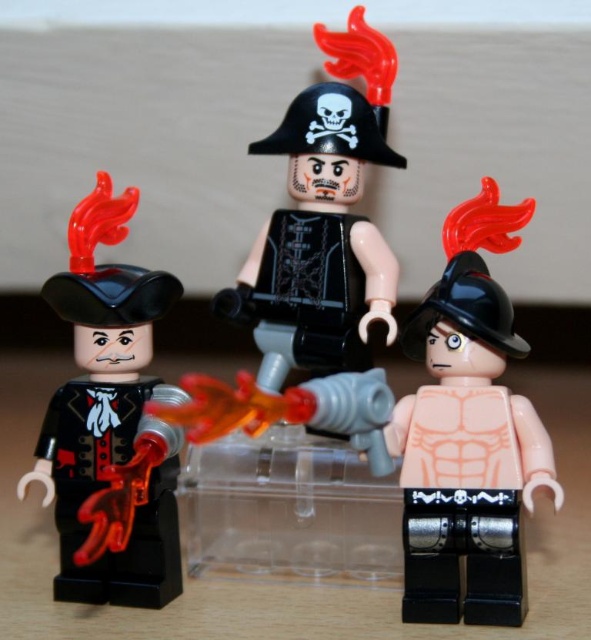
You are trying to fit the matte black torso at center into a box that can only accommodate items narrower than the matte black pirate hat at left. Will it fit?

The matte black torso at center is narrower than the matte black pirate hat at left, so it will fit in the box.